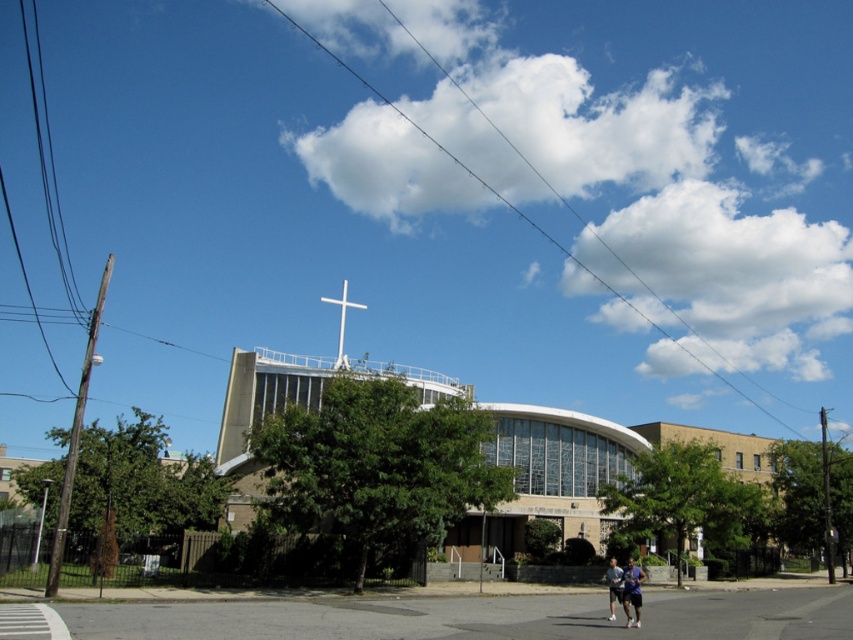
You are standing at the entrance of the modern church and want to take a photo of the white metallic cross at upper center without including the matte blue shorts at lower right in the frame. Which direction should you move to ensure the cross is centered and the shorts are out of view?

Move to the right so that the white metallic cross at upper center is centered and the matte blue shorts at lower right are no longer in the frame.

You are standing at the entrance of the church and want to reach the white metallic cross at upper center. There are matte blue shorts at lower right blocking your path. Can you walk around them?

The matte blue shorts at lower right is 113.68 meters away from the white metallic cross at upper center. Since the distance is quite large, you can easily walk around the matte blue shorts at lower right to reach the white metallic cross at upper center.

You are standing at the entrance of the church and want to find the point marked at coordinates (627, 589). According to the scene description, where would this point be located?

The point marked at coordinates (627, 589) is located on the matte blue shorts at lower right.